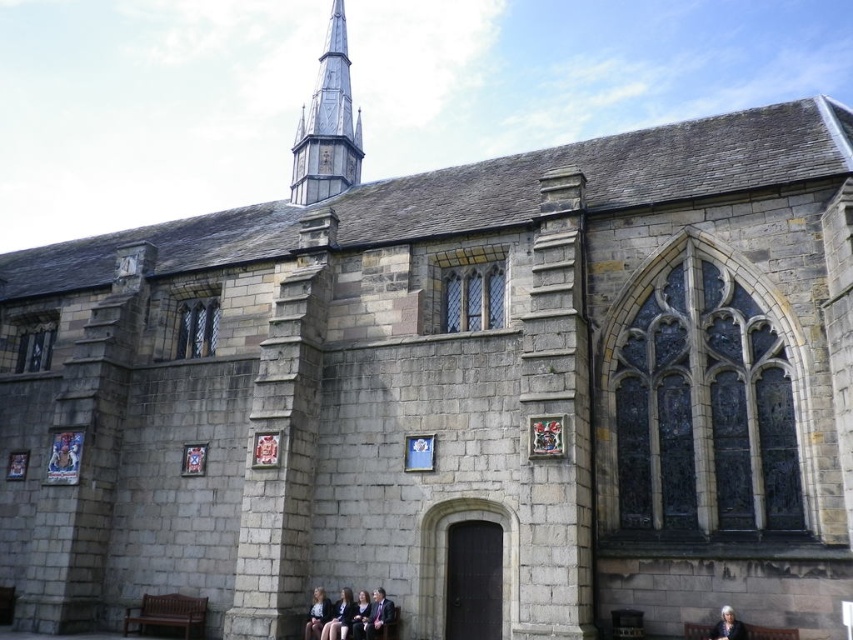
Question: Can you confirm if brown wooden park bench at lower center is positioned above light brown leather jacket at lower center?

Choices:
 (A) yes
 (B) no

Answer: (A)

Question: Can you confirm if smooth skin face at lower center is positioned to the right of light brown leather jacket at lower center?

Choices:
 (A) yes
 (B) no

Answer: (A)

Question: Which object is the closest to the gray stone spire at upper center?

Choices:
 (A) formal suit at lower center
 (B) brown wooden bench at lower left
 (C) dark hair at lower center
 (D) light brown leather jacket at lower center

Answer: (D)

Question: Which point is closer to the camera taking this photo?

Choices:
 (A) coord(347,600)
 (B) coord(347,625)

Answer: (B)

Question: Can you confirm if gray stone spire at upper center is positioned below formal suit at lower center?

Choices:
 (A) yes
 (B) no

Answer: (B)

Question: Estimate the real-world distances between objects in this image. Which object is closer to the gray stone spire at upper center?

Choices:
 (A) light brown leather jacket at lower center
 (B) brown wooden bench at lower left
 (C) smooth skin face at lower center

Answer: (A)